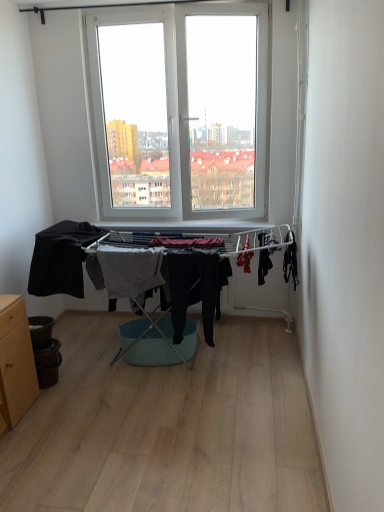
Describe the element at coordinates (61, 258) in the screenshot. The image size is (384, 512). I see `black matte fabric at left, acting as the 1th clothing starting from the left` at that location.

In order to face black matte pants at center, which appears as the third clothing when viewed from the left, should I rotate leftwards or rightwards?

To align with it, rotate right about 0.649°.

This screenshot has height=512, width=384. What do you see at coordinates (195, 288) in the screenshot?
I see `black matte pants at center, which appears as the third clothing when viewed from the left` at bounding box center [195, 288].

The image size is (384, 512). I want to click on gray cotton towel at center, which appears as the third clothing when viewed from the right, so click(130, 272).

Is point (66, 276) less distant than point (138, 285)?

No, (66, 276) is behind (138, 285).

Is black matte fabric at left, acting as the 1th clothing starting from the left, to the left or to the right of gray cotton towel at center, which appears as the third clothing when viewed from the right, in the image?

From the image, it's evident that black matte fabric at left, acting as the 1th clothing starting from the left, is to the left of gray cotton towel at center, which appears as the third clothing when viewed from the right.

Is black matte fabric at left, the 4th clothing when ordered from right to left, next to gray cotton towel at center, which is counted as the second clothing, starting from the left, and touching it?

No, black matte fabric at left, the 4th clothing when ordered from right to left, is not next to gray cotton towel at center, which is counted as the second clothing, starting from the left.

Is black matte fabric at left, acting as the 1th clothing starting from the left, smaller than gray cotton towel at center, which is counted as the second clothing, starting from the left?

No.

From a real-world perspective, who is located lower, black matte pants at center, which appears as the third clothing when viewed from the left, or gray cotton towel at center, which appears as the third clothing when viewed from the right?

In real-world perspective, black matte pants at center, which appears as the third clothing when viewed from the left, is lower.

Considering the positions of point (197, 253) and point (119, 277), is point (197, 253) closer or farther from the camera than point (119, 277)?

Point (197, 253) is positioned closer to the camera compared to point (119, 277).

Does black matte pants at center, the second clothing from the right, turn towards gray cotton towel at center, which is counted as the second clothing, starting from the left?

No, black matte pants at center, the second clothing from the right, is not oriented towards gray cotton towel at center, which is counted as the second clothing, starting from the left.

Is black matte fabric at left, the 4th clothing when ordered from right to left, not near black matte pants at center, the second clothing from the right?

No, black matte fabric at left, the 4th clothing when ordered from right to left, is not far from black matte pants at center, the second clothing from the right.

From the image's perspective, is black matte fabric at left, acting as the 1th clothing starting from the left, on top of black matte pants at center, which appears as the third clothing when viewed from the left?

Yes.

Is black matte fabric at left, acting as the 1th clothing starting from the left, in front of or behind black matte pants at center, the second clothing from the right, in the image?

In the image, black matte fabric at left, acting as the 1th clothing starting from the left, appears behind black matte pants at center, the second clothing from the right.

Between wooden cabinet at lower left and black matte pants at center, which appears as the third clothing when viewed from the left, which one appears on the right side from the viewer's perspective?

black matte pants at center, which appears as the third clothing when viewed from the left.

Is wooden cabinet at lower left surrounding black matte pants at center, which appears as the third clothing when viewed from the left?

That's incorrect, black matte pants at center, which appears as the third clothing when viewed from the left, is not inside wooden cabinet at lower left.

Measure the distance between wooden cabinet at lower left and black matte pants at center, the second clothing from the right.

wooden cabinet at lower left is 1.09 meters from black matte pants at center, the second clothing from the right.

Does wooden cabinet at lower left come behind black matte pants at center, the second clothing from the right?

No.

Find the location of a particular element. The image size is (384, 512). clothing that is the 3rd one when counting backward from the wooden cabinet at lower left is located at coordinates (130, 272).

From the image's perspective, which one is positioned higher, gray cotton towel at center, which is counted as the second clothing, starting from the left, or wooden cabinet at lower left?

gray cotton towel at center, which is counted as the second clothing, starting from the left, is shown above in the image.

Can you confirm if gray cotton towel at center, which appears as the third clothing when viewed from the right, is thinner than wooden cabinet at lower left?

Correct, the width of gray cotton towel at center, which appears as the third clothing when viewed from the right, is less than that of wooden cabinet at lower left.

From a real-world perspective, who is located lower, gray cotton towel at center, which is counted as the second clothing, starting from the left, or wooden cabinet at lower left?

wooden cabinet at lower left is physically lower.

Which is in front, black matte pants at center, which appears as the third clothing when viewed from the left, or black matte clothing at right, marked as the fourth clothing in a left-to-right arrangement?

black matte clothing at right, marked as the fourth clothing in a left-to-right arrangement, is more forward.

Looking at this image, can you confirm if black matte pants at center, which appears as the third clothing when viewed from the left, is shorter than black matte clothing at right, the first clothing in the right-to-left sequence?

No, black matte pants at center, which appears as the third clothing when viewed from the left, is not shorter than black matte clothing at right, the first clothing in the right-to-left sequence.

From a real-world perspective, is black matte pants at center, which appears as the third clothing when viewed from the left, over black matte clothing at right, the first clothing in the right-to-left sequence?

Incorrect, from a real-world perspective, black matte pants at center, which appears as the third clothing when viewed from the left, is lower than black matte clothing at right, the first clothing in the right-to-left sequence.

Would you say black matte clothing at right, marked as the fourth clothing in a left-to-right arrangement, is part of black matte pants at center, which appears as the third clothing when viewed from the left,'s contents?

That's incorrect, black matte clothing at right, marked as the fourth clothing in a left-to-right arrangement, is not inside black matte pants at center, which appears as the third clothing when viewed from the left.

From a real-world perspective, is gray cotton towel at center, which is counted as the second clothing, starting from the left, over black matte pants at center, which appears as the third clothing when viewed from the left?

Correct, in the physical world, gray cotton towel at center, which is counted as the second clothing, starting from the left, is higher than black matte pants at center, which appears as the third clothing when viewed from the left.

Considering the relative sizes of gray cotton towel at center, which appears as the third clothing when viewed from the right, and black matte pants at center, which appears as the third clothing when viewed from the left, in the image provided, is gray cotton towel at center, which appears as the third clothing when viewed from the right, smaller than black matte pants at center, which appears as the third clothing when viewed from the left,?

No, gray cotton towel at center, which appears as the third clothing when viewed from the right, is not smaller than black matte pants at center, which appears as the third clothing when viewed from the left.

How different are the orientations of gray cotton towel at center, which appears as the third clothing when viewed from the right, and black matte pants at center, the second clothing from the right, in degrees?

gray cotton towel at center, which appears as the third clothing when viewed from the right, and black matte pants at center, the second clothing from the right, are facing 0.000168 degrees away from each other.

Is point (156, 282) farther from camera compared to point (205, 312)?

No, it is in front of (205, 312).

At what (x,y) coordinates should I click in order to perform the action: click on the 1st clothing in front of the black matte fabric at left, acting as the 1th clothing starting from the left, starting your count from the anchor. Please return your answer as a coordinate pair (x, y). The image size is (384, 512). Looking at the image, I should click on (130, 272).

This screenshot has height=512, width=384. Identify the location of the 1st clothing to the right of the gray cotton towel at center, which is counted as the second clothing, starting from the left, starting your count from the anchor. (195, 288).

In the scene shown: Looking at the image, which one is located further to black matte pants at center, which appears as the third clothing when viewed from the left, gray cotton towel at center, which is counted as the second clothing, starting from the left, or black matte clothing at right, the first clothing in the right-to-left sequence?

Among the two, black matte clothing at right, the first clothing in the right-to-left sequence, is located further to black matte pants at center, which appears as the third clothing when viewed from the left.

From the image, which object appears to be nearer to black matte pants at center, which appears as the third clothing when viewed from the left, black matte clothing at right, marked as the fourth clothing in a left-to-right arrangement, or black matte fabric at left, the 4th clothing when ordered from right to left?

Based on the image, black matte clothing at right, marked as the fourth clothing in a left-to-right arrangement, appears to be nearer to black matte pants at center, which appears as the third clothing when viewed from the left.

Based on their spatial positions, is black matte pants at center, the second clothing from the right, or black matte clothing at right, the first clothing in the right-to-left sequence, further from wooden cabinet at lower left?

The object further to wooden cabinet at lower left is black matte clothing at right, the first clothing in the right-to-left sequence.

From the image, which object appears to be nearer to black matte clothing at right, the first clothing in the right-to-left sequence, black matte pants at center, the second clothing from the right, or wooden cabinet at lower left?

black matte pants at center, the second clothing from the right, lies closer to black matte clothing at right, the first clothing in the right-to-left sequence, than the other object.

From the picture: Based on their spatial positions, is gray cotton towel at center, which is counted as the second clothing, starting from the left, or black matte fabric at left, acting as the 1th clothing starting from the left, further from wooden cabinet at lower left?

Among the two, gray cotton towel at center, which is counted as the second clothing, starting from the left, is located further to wooden cabinet at lower left.

From the image, which object appears to be nearer to black matte pants at center, the second clothing from the right, black matte fabric at left, acting as the 1th clothing starting from the left, or black matte clothing at right, the first clothing in the right-to-left sequence?

black matte clothing at right, the first clothing in the right-to-left sequence, is closer to black matte pants at center, the second clothing from the right.

Looking at the image, which one is located further to black matte clothing at right, the first clothing in the right-to-left sequence, black matte pants at center, the second clothing from the right, or black matte fabric at left, the 4th clothing when ordered from right to left?

black matte fabric at left, the 4th clothing when ordered from right to left, is positioned further to the anchor black matte clothing at right, the first clothing in the right-to-left sequence.

Which object lies nearer to the anchor point black matte fabric at left, acting as the 1th clothing starting from the left, wooden cabinet at lower left or black matte clothing at right, marked as the fourth clothing in a left-to-right arrangement?

Among the two, wooden cabinet at lower left is located nearer to black matte fabric at left, acting as the 1th clothing starting from the left.

Find the location of a particular element. The image size is (384, 512). clothing situated between gray cotton towel at center, which appears as the third clothing when viewed from the right, and black matte clothing at right, the first clothing in the right-to-left sequence, from left to right is located at coordinates (195, 288).

What are the coordinates of `clothing between black matte fabric at left, acting as the 1th clothing starting from the left, and black matte pants at center, which appears as the third clothing when viewed from the left, in the horizontal direction` in the screenshot? It's located at (130, 272).